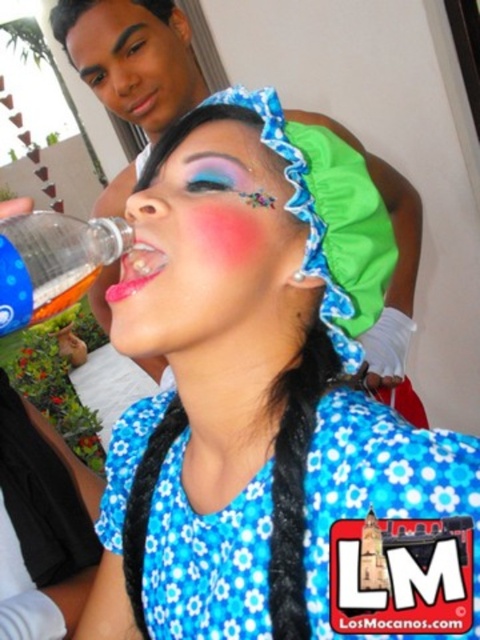
Consider the image. You are a person who wants to grab the smaller bottle first. Which one should you choose between the matte plastic bottle at upper left and the smooth plastic bottle at upper left?

The matte plastic bottle at upper left is smaller than the smooth plastic bottle at upper left, so you should choose the matte plastic bottle at upper left.

You are at a picnic and see two bottles. The smooth plastic bottle at upper left and the translucent plastic bottle at left. Which one is higher?

The smooth plastic bottle at upper left is above the translucent plastic bottle at left, so it is higher.

You are at a picnic and need to grab a bottle. There are two plastic bottles visible in the scene. The matte plastic bottle at upper left and the translucent plastic bottle at left. Which one is located to the right of the other?

The matte plastic bottle at upper left is positioned on the right side of the translucent plastic bottle at left.